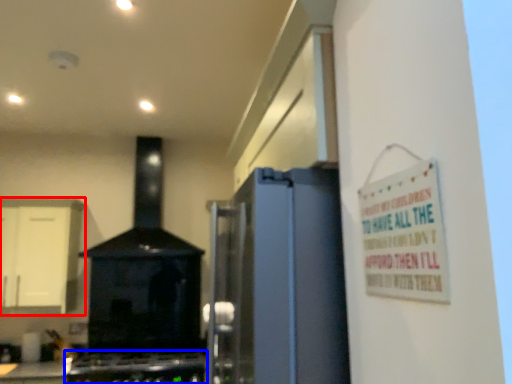
Question: Which object is closer to the camera taking this photo, cabinetry (highlighted by a red box) or gas stove (highlighted by a blue box)?

Choices:
 (A) cabinetry
 (B) gas stove

Answer: (B)